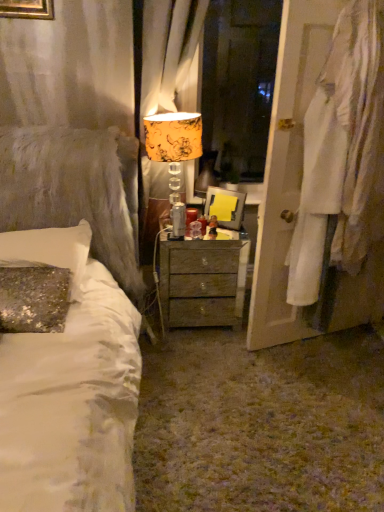
Find the location of a particular element. This screenshot has height=512, width=384. free spot in front of wooden nightstand at center is located at coordinates (199, 357).